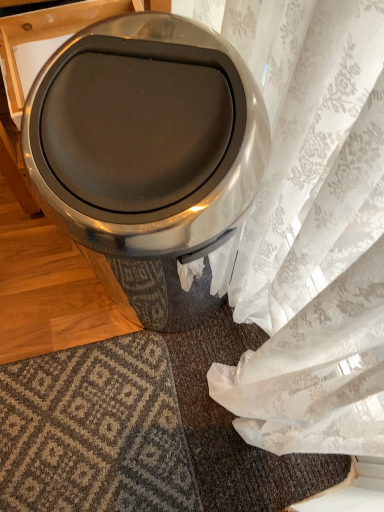
At what (x,y) coordinates should I click in order to perform the action: click on brushed metal trash can at center. Please return your answer as a coordinate pair (x, y). Looking at the image, I should click on (147, 154).

What do you see at coordinates (147, 154) in the screenshot?
I see `brushed metal trash can at center` at bounding box center [147, 154].

This screenshot has width=384, height=512. I want to click on brushed metal trash can at center, so click(x=147, y=154).